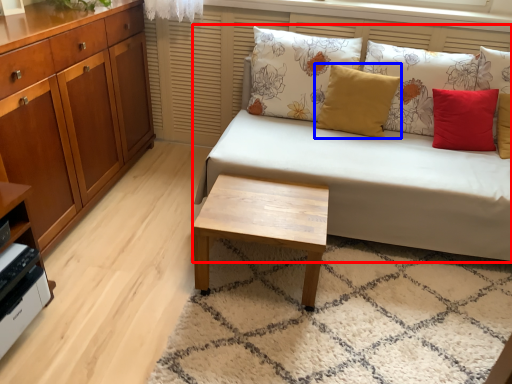
Question: Which of the following is the closest to the observer, studio couch (highlighted by a red box) or pillow (highlighted by a blue box)?

Choices:
 (A) studio couch
 (B) pillow

Answer: (A)